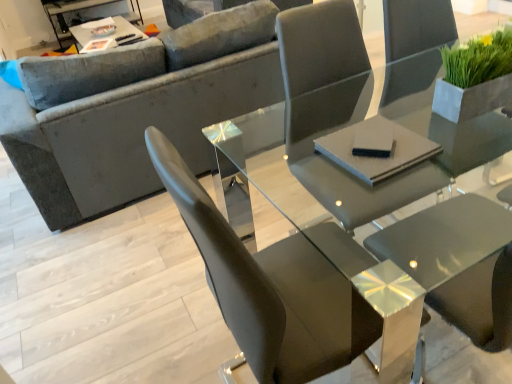
Question: Considering the relative sizes of velvet gray couch at upper left and green matte plant at upper right in the image provided, is velvet gray couch at upper left taller than green matte plant at upper right?

Choices:
 (A) no
 (B) yes

Answer: (B)

Question: From a real-world perspective, does velvet gray couch at upper left stand above green matte plant at upper right?

Choices:
 (A) yes
 (B) no

Answer: (B)

Question: From the image's perspective, would you say velvet gray couch at upper left is positioned over green matte plant at upper right?

Choices:
 (A) no
 (B) yes

Answer: (B)

Question: Are velvet gray couch at upper left and green matte plant at upper right making contact?

Choices:
 (A) yes
 (B) no

Answer: (B)

Question: Does velvet gray couch at upper left lie in front of green matte plant at upper right?

Choices:
 (A) no
 (B) yes

Answer: (A)

Question: Is black matte pad at center, positioned as the 1th pad in left-to-right order, spatially inside metallic silver tray at upper left, the 1th table positioned from the back, or outside of it?

Choices:
 (A) inside
 (B) outside

Answer: (B)

Question: Based on their positions, is black matte pad at center, positioned as the 2th pad in right-to-left order, located to the left or right of metallic silver tray at upper left, the 1th table positioned from the top?

Choices:
 (A) left
 (B) right

Answer: (B)

Question: From a real-world perspective, is black matte pad at center, positioned as the 2th pad in right-to-left order, physically located above or below metallic silver tray at upper left, placed as the 1th table when sorted from left to right?

Choices:
 (A) below
 (B) above

Answer: (B)

Question: Considering their positions, is black matte pad at center, positioned as the 1th pad in left-to-right order, located in front of or behind metallic silver tray at upper left, placed as the second table when sorted from front to back?

Choices:
 (A) behind
 (B) front

Answer: (B)

Question: From the image's perspective, relative to green matte plant at upper right, is matte gray chair at center above or below?

Choices:
 (A) below
 (B) above

Answer: (A)

Question: In terms of height, does matte gray chair at center look taller or shorter compared to green matte plant at upper right?

Choices:
 (A) tall
 (B) short

Answer: (A)

Question: Looking at their shapes, would you say matte gray chair at center is wider or thinner than green matte plant at upper right?

Choices:
 (A) wide
 (B) thin

Answer: (A)

Question: Is point (399, 79) closer or farther from the camera than point (460, 77)?

Choices:
 (A) closer
 (B) farther

Answer: (B)

Question: Does point (286, 129) appear closer or farther from the camera than point (134, 26)?

Choices:
 (A) closer
 (B) farther

Answer: (A)

Question: Is glossy glass table at center, positioned as the first table in bottom-to-top order, bigger or smaller than metallic silver tray at upper left, the 1th table positioned from the back?

Choices:
 (A) big
 (B) small

Answer: (A)